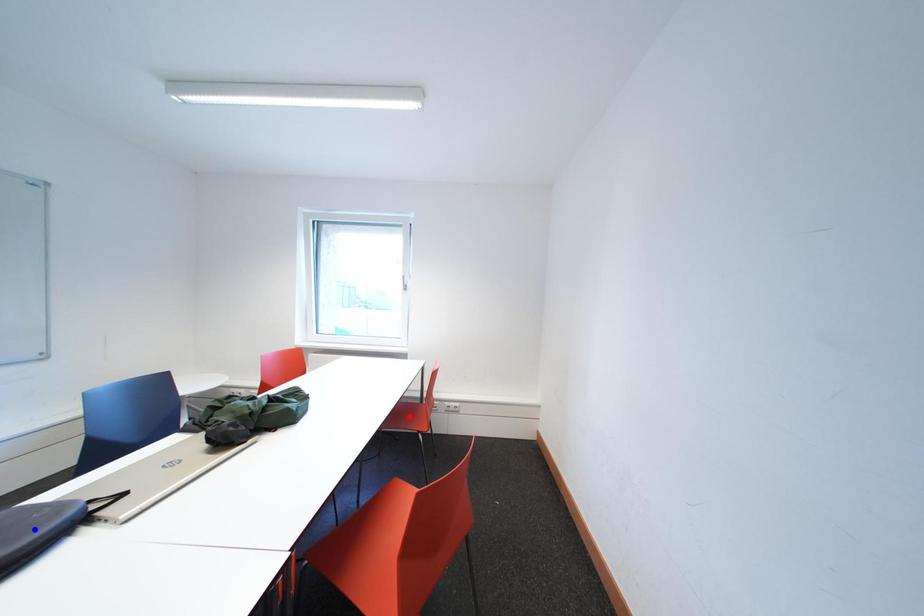
Question: In the image, two points are highlighted. Which point is nearer to the camera? Reply with the corresponding letter.

Choices:
 (A) blue point
 (B) red point

Answer: (A)